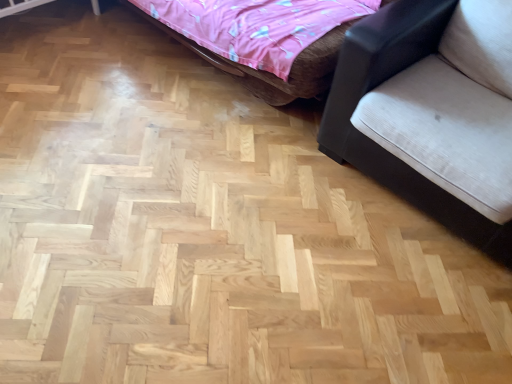
Measure the distance between point (x=285, y=84) and camera.

Point (x=285, y=84) and camera are 1.84 meters apart.

This screenshot has height=384, width=512. I want to click on pink fabric bed at upper center, so click(x=273, y=74).

In order to face pink fabric bed at upper center, should I rotate leftwards or rightwards?

To align with it, rotate left about 2.664°.

This screenshot has width=512, height=384. Describe the element at coordinates (273, 74) in the screenshot. I see `pink fabric bed at upper center` at that location.

Find the location of a particular element. The image size is (512, 384). pink fabric bed at upper center is located at coordinates (273, 74).